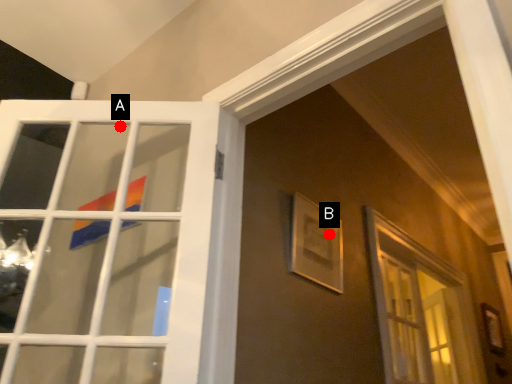
Question: Two points are circled on the image, labeled by A and B beside each circle. Which point appears farthest from the camera in this image?

Choices:
 (A) A is further
 (B) B is further

Answer: (A)